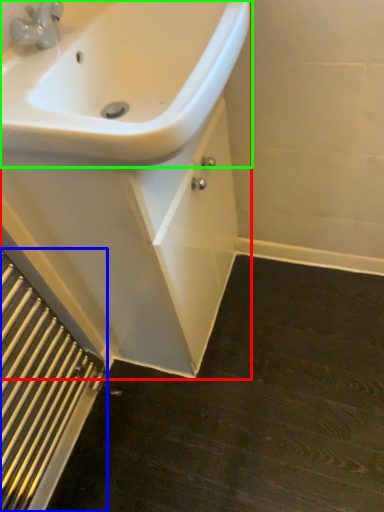
Question: Considering the real-world distances, which object is closest to porcelain (highlighted by a red box)? radiator (highlighted by a blue box) or sink (highlighted by a green box).

Choices:
 (A) radiator
 (B) sink

Answer: (B)